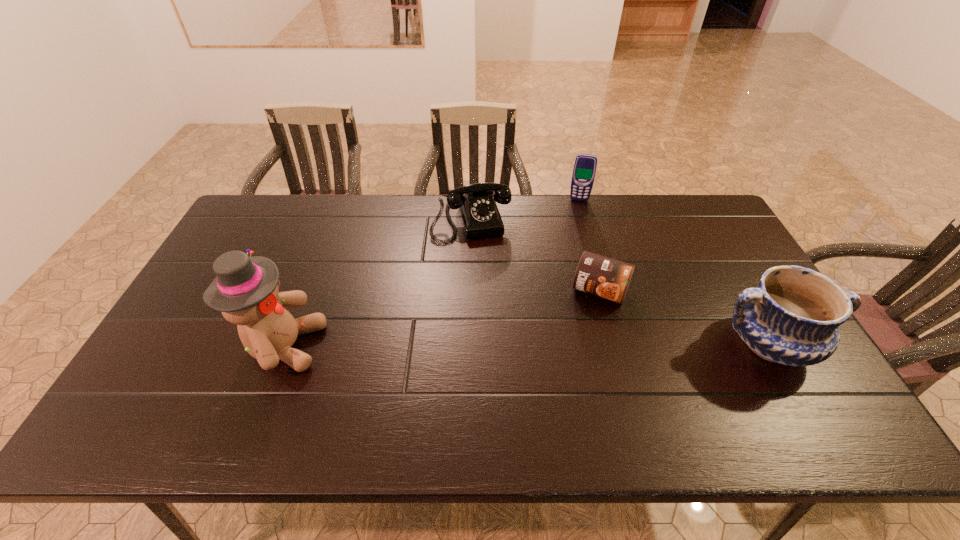
The width and height of the screenshot is (960, 540). Find the location of `vacant space on the desktop that is between the rag_doll and the pottery and is positioned on the front label of the can`. vacant space on the desktop that is between the rag_doll and the pottery and is positioned on the front label of the can is located at coordinates (578, 345).

This screenshot has height=540, width=960. I want to click on vacant space on the desktop that is between the rag_doll and the pottery and is positioned on the front-facing side of the cellular telephone, so click(x=561, y=345).

At what (x,y) coordinates should I click in order to perform the action: click on free space on the desktop that is between the rag_doll and the pottery and is positioned on the dial of the telephone. Please return your answer as a coordinate pair (x, y). This screenshot has width=960, height=540. Looking at the image, I should click on (505, 345).